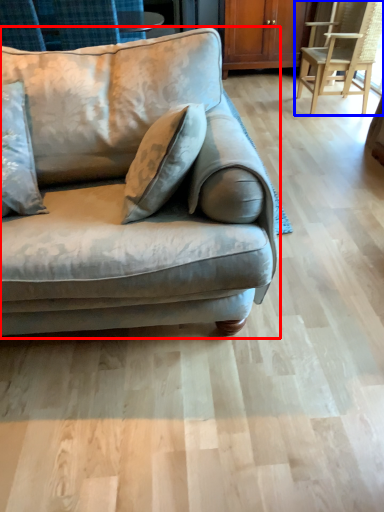
Question: Which object is further to the camera taking this photo, studio couch (highlighted by a red box) or chair (highlighted by a blue box)?

Choices:
 (A) studio couch
 (B) chair

Answer: (B)